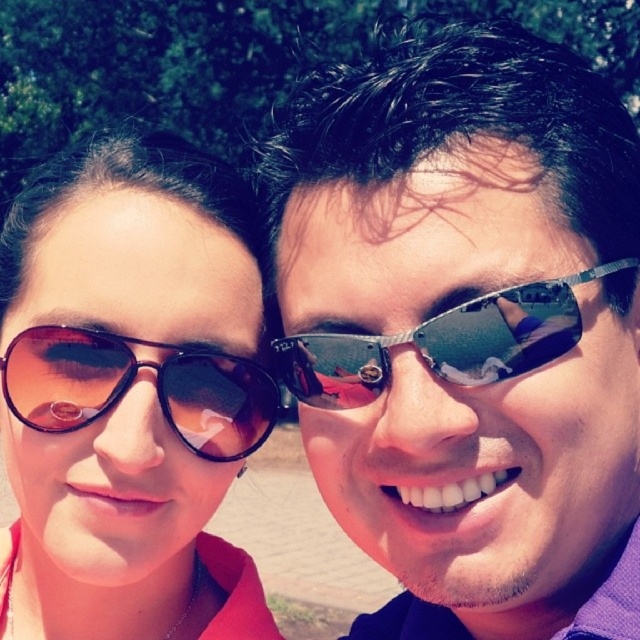
Measure the distance from matte black sunglasses at left to shiny metallic sunglasses at center.

matte black sunglasses at left is 30.35 centimeters away from shiny metallic sunglasses at center.

In the scene shown: Does matte black sunglasses at left have a greater height compared to shiny metallic sunglasses at center?

Yes.

At what (x,y) coordinates should I click in order to perform the action: click on matte black sunglasses at left. Please return your answer as a coordinate pair (x, y). Looking at the image, I should click on (129, 396).

Locate an element on the screen. matte black sunglasses at left is located at coordinates (129, 396).

Does matte black sunglasses at left have a smaller size compared to matte black goggles at left?

Incorrect, matte black sunglasses at left is not smaller in size than matte black goggles at left.

Is matte black sunglasses at left taller than matte black goggles at left?

Correct, matte black sunglasses at left is much taller as matte black goggles at left.

Which is in front, point (214, 627) or point (220, 358)?

Positioned in front is point (220, 358).

Identify the location of matte black sunglasses at left. (129, 396).

Is matte black goggles at left bigger than shiny metallic sunglasses at center?

Actually, matte black goggles at left might be smaller than shiny metallic sunglasses at center.

Is matte black goggles at left to the right of shiny metallic sunglasses at center from the viewer's perspective?

In fact, matte black goggles at left is to the left of shiny metallic sunglasses at center.

This screenshot has height=640, width=640. What do you see at coordinates (131, 384) in the screenshot? I see `matte black goggles at left` at bounding box center [131, 384].

The height and width of the screenshot is (640, 640). I want to click on matte black goggles at left, so click(131, 384).